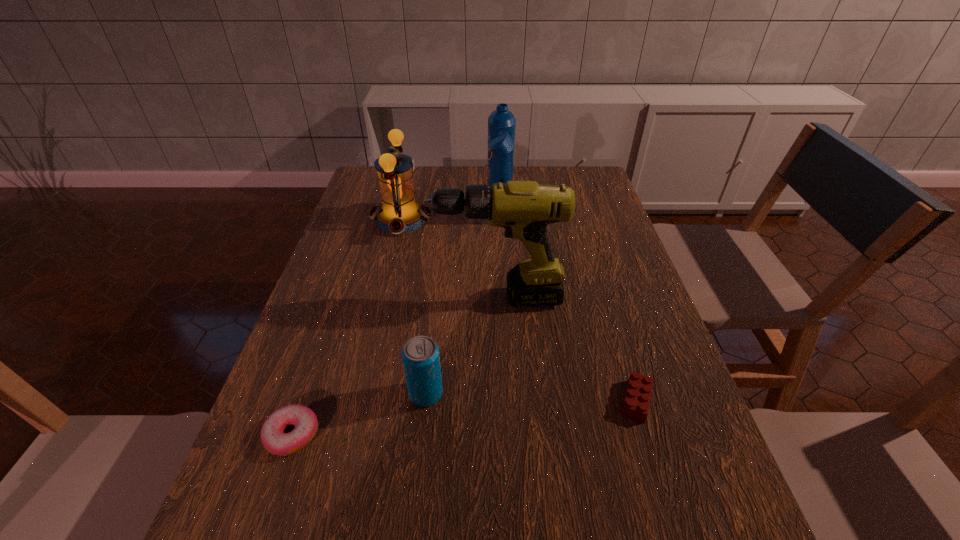
Locate an element on the screen. This screenshot has height=540, width=960. vacant space located on the front-facing side of the lantern is located at coordinates (468, 219).

Where is `vacant area located 0.150m on the left of the fourth tallest object`? This screenshot has height=540, width=960. vacant area located 0.150m on the left of the fourth tallest object is located at coordinates (336, 393).

In order to click on vacant space located 0.260m on the right of the doughnut in this screenshot , I will do `click(455, 434)`.

This screenshot has width=960, height=540. I want to click on vacant region located on the left of the Lego, so click(x=572, y=401).

The width and height of the screenshot is (960, 540). What are the coordinates of `lantern present at the left edge` in the screenshot? It's located at (400, 213).

Where is `doughnut that is positioned at the left edge`? doughnut that is positioned at the left edge is located at coordinates (305, 421).

Identify the location of object that is at the right edge. (637, 398).

Locate an element on the screen. Image resolution: width=960 pixels, height=540 pixels. free space at the far edge of the desktop is located at coordinates (547, 176).

The width and height of the screenshot is (960, 540). In order to click on free space at the left edge in this screenshot , I will do `click(321, 275)`.

The width and height of the screenshot is (960, 540). What are the coordinates of `vacant space at the right edge` in the screenshot? It's located at (633, 494).